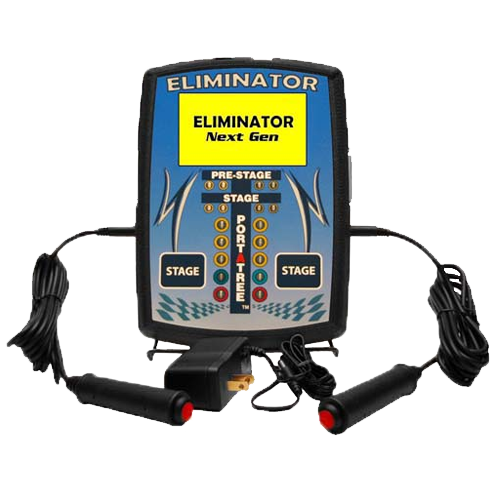
At what (x,y) coordinates should I click in order to perform the action: click on game machine. Please return your answer as a coordinate pair (x, y). The height and width of the screenshot is (500, 500). Looking at the image, I should click on (244, 76).